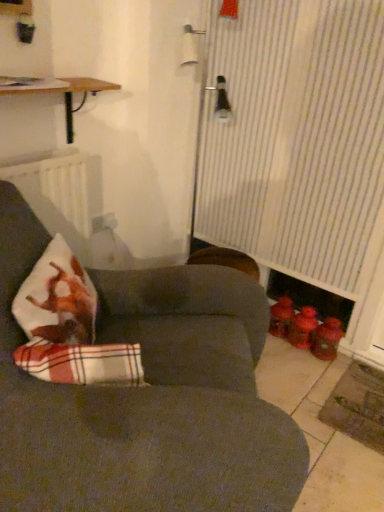
Question: Is wooden shelf at upper left not within dark gray fabric couch at center?

Choices:
 (A) no
 (B) yes

Answer: (B)

Question: Is wooden shelf at upper left behind dark gray fabric couch at center?

Choices:
 (A) yes
 (B) no

Answer: (A)

Question: Is wooden shelf at upper left smaller than dark gray fabric couch at center?

Choices:
 (A) no
 (B) yes

Answer: (B)

Question: Is dark gray fabric couch at center at the back of wooden shelf at upper left?

Choices:
 (A) no
 (B) yes

Answer: (A)

Question: Does wooden shelf at upper left have a lesser width compared to dark gray fabric couch at center?

Choices:
 (A) no
 (B) yes

Answer: (B)

Question: Considering the positions of point (39, 289) and point (13, 413), is point (39, 289) closer or farther from the camera than point (13, 413)?

Choices:
 (A) closer
 (B) farther

Answer: (B)

Question: Considering their positions, is plush white pillow with red plaid at left located in front of or behind dark gray fabric couch at center?

Choices:
 (A) front
 (B) behind

Answer: (B)

Question: Considering the positions of plush white pillow with red plaid at left and dark gray fabric couch at center in the image, is plush white pillow with red plaid at left taller or shorter than dark gray fabric couch at center?

Choices:
 (A) tall
 (B) short

Answer: (B)

Question: Is plush white pillow with red plaid at left inside the boundaries of dark gray fabric couch at center, or outside?

Choices:
 (A) outside
 (B) inside

Answer: (B)

Question: From their relative heights in the image, would you say wooden shelf at upper left is taller or shorter than white matte radiator at left?

Choices:
 (A) short
 (B) tall

Answer: (A)

Question: Is wooden shelf at upper left bigger or smaller than white matte radiator at left?

Choices:
 (A) big
 (B) small

Answer: (A)

Question: Is wooden shelf at upper left inside or outside of white matte radiator at left?

Choices:
 (A) inside
 (B) outside

Answer: (B)

Question: From a real-world perspective, is wooden shelf at upper left positioned above or below white matte radiator at left?

Choices:
 (A) above
 (B) below

Answer: (A)

Question: Considering the relative positions of white striped curtain at right and plush white pillow with red plaid at left in the image provided, is white striped curtain at right to the left or to the right of plush white pillow with red plaid at left?

Choices:
 (A) right
 (B) left

Answer: (A)

Question: Considering the positions of white striped curtain at right and plush white pillow with red plaid at left in the image, is white striped curtain at right taller or shorter than plush white pillow with red plaid at left?

Choices:
 (A) tall
 (B) short

Answer: (A)